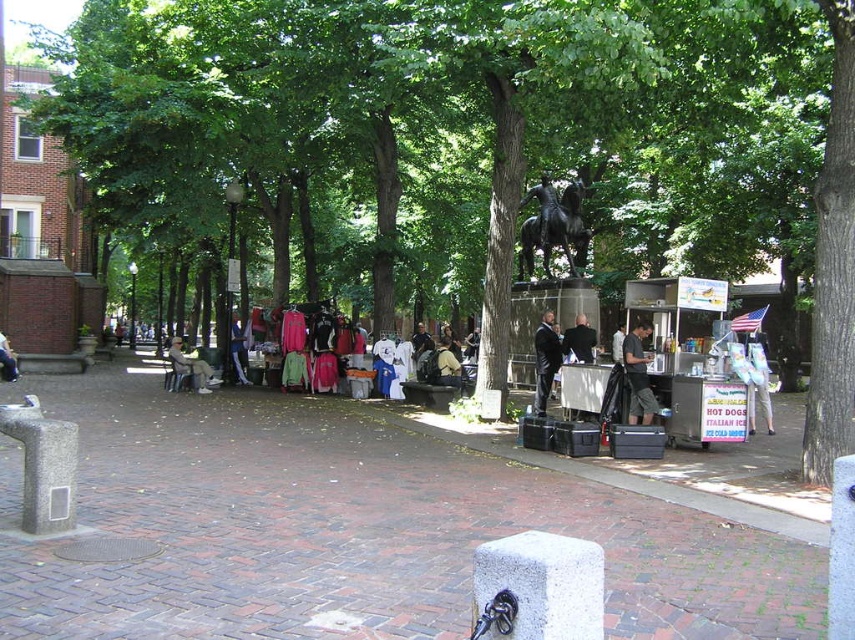
Is green leafy tree at center wider than khaki pants at center?

Correct, the width of green leafy tree at center exceeds that of khaki pants at center.

Who is more forward, (323, 243) or (174, 371)?

Point (174, 371)

Find the location of a particular element. green leafy tree at center is located at coordinates (485, 138).

Does dark gray shirt at right appear over khaki pants at center?

Yes.

Can you confirm if dark gray shirt at right is shorter than khaki pants at center?

No.

What do you see at coordinates (638, 376) in the screenshot? The width and height of the screenshot is (855, 640). I see `dark gray shirt at right` at bounding box center [638, 376].

Locate an element on the screen. Image resolution: width=855 pixels, height=640 pixels. dark gray shirt at right is located at coordinates (638, 376).

Does khaki pants at center appear on the right side of denim jacket at center?

No, khaki pants at center is not to the right of denim jacket at center.

Is point (195, 365) farther from viewer compared to point (239, 339)?

No, (195, 365) is in front of (239, 339).

Between point (175, 348) and point (240, 378), which one is positioned behind?

The point (240, 378) is more distant.

Find the location of `khaki pants at center`. khaki pants at center is located at coordinates (189, 365).